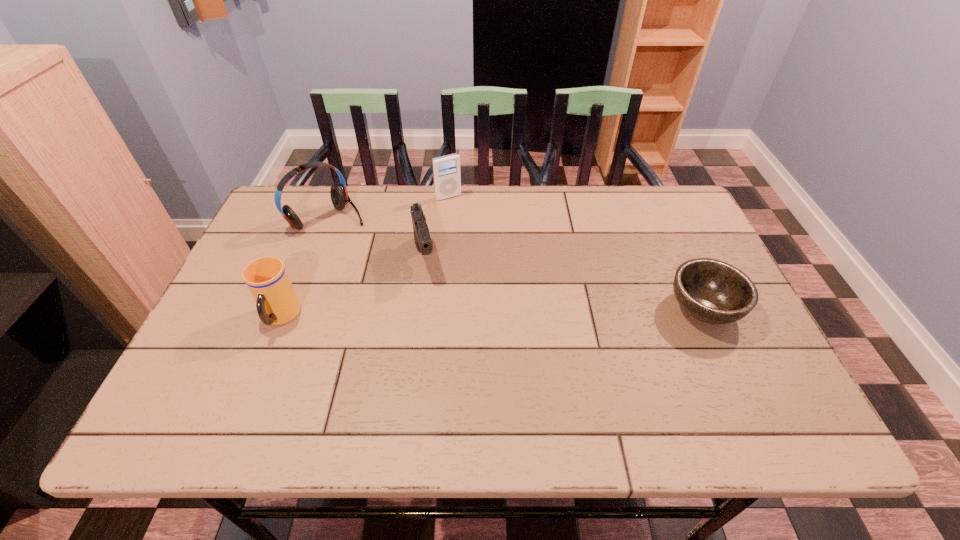
Locate an element on the screen. The image size is (960, 540). free space between the cup and the shortest object is located at coordinates (492, 313).

Where is `unoccupied position between the headset and the farthest object`? The image size is (960, 540). unoccupied position between the headset and the farthest object is located at coordinates (388, 208).

I want to click on vacant area that lies between the rightmost object and the iPod, so click(576, 252).

Where is `free space between the pistol and the farthest object`? The width and height of the screenshot is (960, 540). free space between the pistol and the farthest object is located at coordinates (437, 227).

Find the location of a particular element. blank region between the headset and the shortest object is located at coordinates (516, 264).

Locate an element on the screen. The image size is (960, 540). free spot between the shortest object and the cup is located at coordinates (492, 313).

What are the coordinates of `free spot between the cup and the pistol` in the screenshot? It's located at (352, 288).

This screenshot has width=960, height=540. What are the coordinates of `empty location between the pistol and the headset` in the screenshot? It's located at (376, 238).

Image resolution: width=960 pixels, height=540 pixels. In order to click on free area in between the farthest object and the cup in this screenshot , I will do `click(365, 258)`.

Select which object is the fourth closest to the farthest object. Please provide its 2D coordinates. Your answer should be formatted as a tuple, i.e. [(x, y)], where the tuple contains the x and y coordinates of a point satisfying the conditions above.

[(712, 291)]